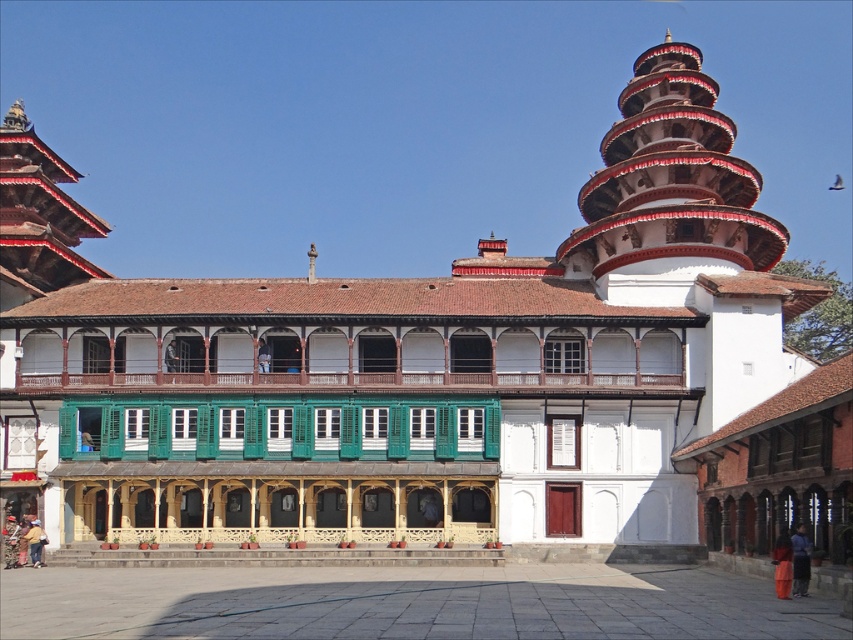
Question: Is white painted wood tower at upper right to the right of dark blue fabric at lower right from the viewer's perspective?

Choices:
 (A) yes
 (B) no

Answer: (A)

Question: Does white painted wood tower at upper right lie in front of dark blue fabric at lower right?

Choices:
 (A) yes
 (B) no

Answer: (B)

Question: Can you confirm if white painted wood tower at upper right is bigger than dark blue fabric at lower right?

Choices:
 (A) no
 (B) yes

Answer: (B)

Question: Which point is closer to the camera?

Choices:
 (A) (660, 112)
 (B) (793, 586)

Answer: (B)